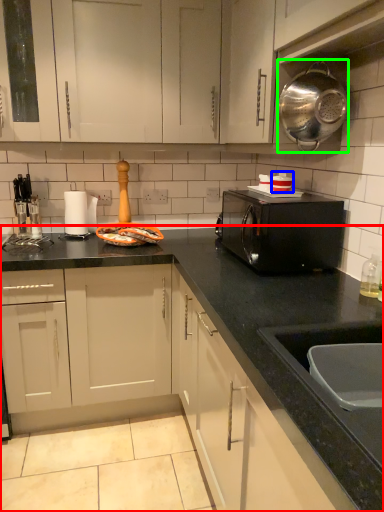
Question: Which is nearer to the countertop (highlighted by a red box)? appliance (highlighted by a blue box) or kitchen appliance (highlighted by a green box).

Choices:
 (A) appliance
 (B) kitchen appliance

Answer: (A)